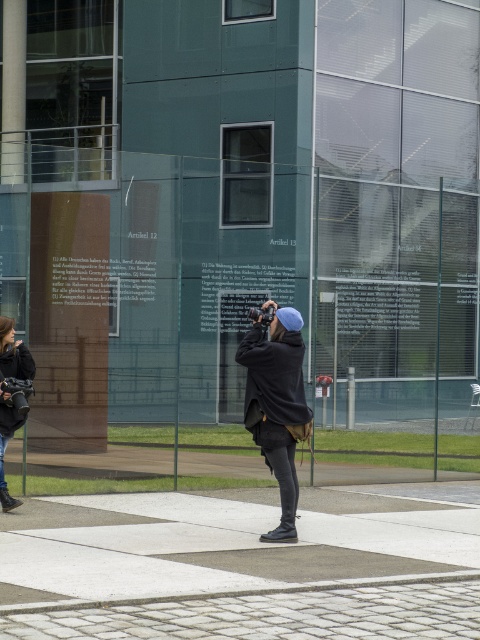
Consider the image. You are a fashion designer observing an urban scene. You notice two jackets in the image. Which jacket, the matte black jacket at center or the denim jacket at lower left, would you recommend for a client who prefers a more prominent look?

The matte black jacket at center is bigger than the denim jacket at lower left, so it would be more prominent and suitable for a client who prefers a more prominent look.

You are a fashion designer observing the scene. You notice the matte black jacket at center and the denim jacket at lower left. Which jacket is positioned higher in the image?

The matte black jacket at center is positioned higher in the image than the denim jacket at lower left.